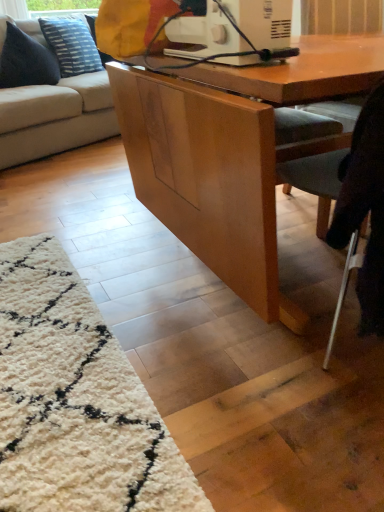
Where is `vacant space situated on the left part of light gray fabric chair at lower right`? Image resolution: width=384 pixels, height=512 pixels. vacant space situated on the left part of light gray fabric chair at lower right is located at coordinates (214, 354).